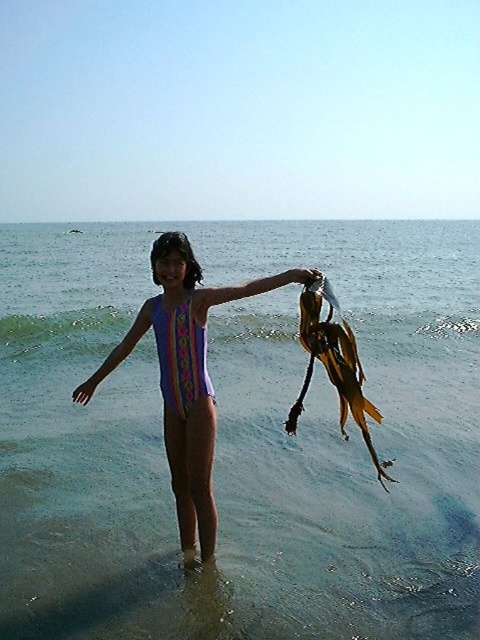
Based on the scene description, where is the clear water at center located in the image?

The clear water at center is located at the 2D point coordinates of (x=241, y=440).

You are a photographer trying to capture the purple matte swimsuit at center. The clear water at center is in the way. Can you adjust your angle to focus on the swimsuit without the water blocking it?

The clear water at center is positioned over purple matte swimsuit at center, so adjusting the angle might allow focusing on the swimsuit by shooting from below or the side to avoid the water blocking it.